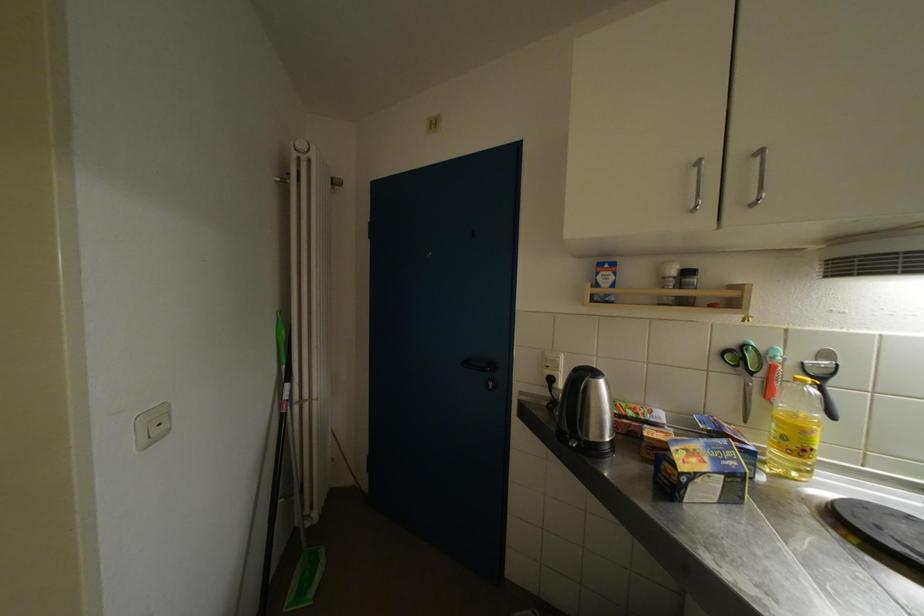
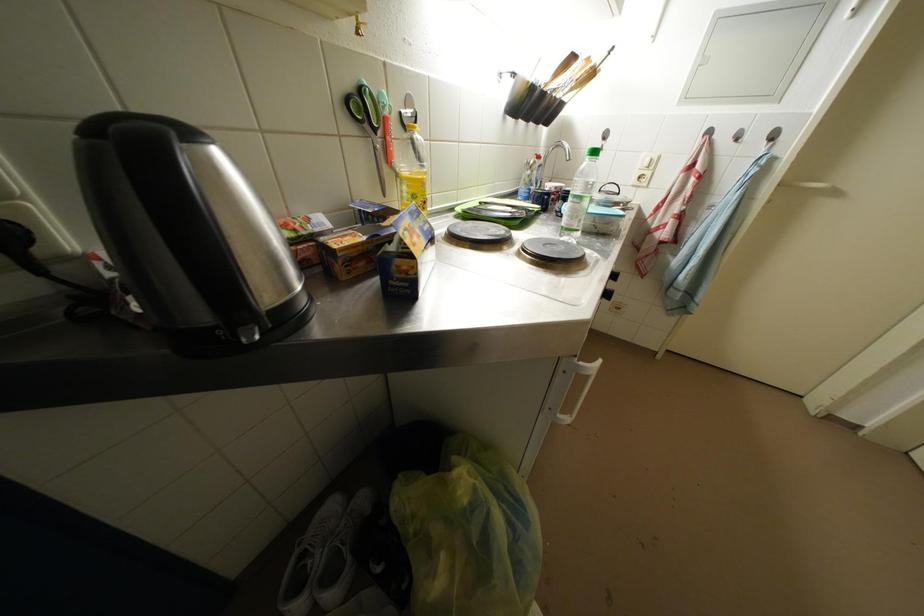
The first image is from the beginning of the video and the second image is from the end. How did the camera likely rotate when shooting the video?

The camera's rotation is toward right-down.